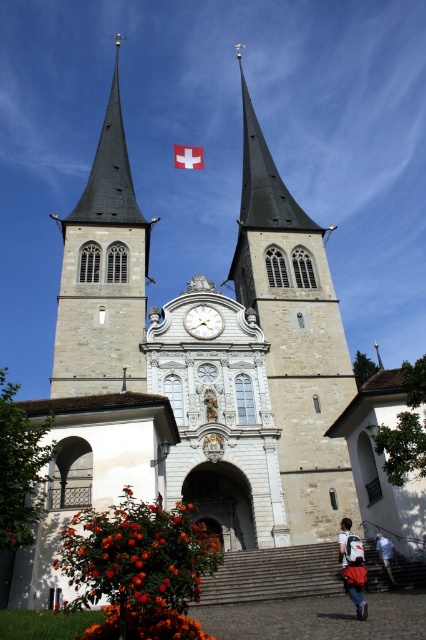
Question: Is white glossy clock at center above white fabric flag at center?

Choices:
 (A) no
 (B) yes

Answer: (A)

Question: Which object is closer to the camera taking this photo?

Choices:
 (A) denim jacket at lower right
 (B) smooth stone tower at center

Answer: (A)

Question: Does gray stone bell tower at left lie behind blue fabric pants at lower right?

Choices:
 (A) yes
 (B) no

Answer: (A)

Question: Can you confirm if white fabric flag at center is positioned to the left of blue fabric pants at lower right?

Choices:
 (A) no
 (B) yes

Answer: (B)

Question: Which object is the farthest from the gray stone bell tower at left?

Choices:
 (A) smooth stone tower at center
 (B) white glossy clock at center

Answer: (B)

Question: Which object is farther from the camera taking this photo?

Choices:
 (A) gray stone bell tower at left
 (B) white fabric flag at center
 (C) white glossy clock at center

Answer: (B)